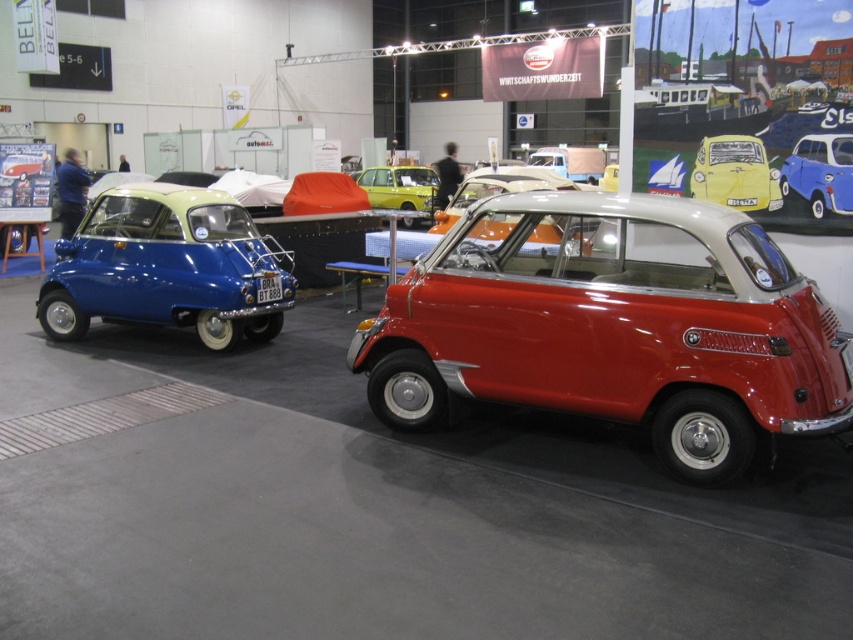
You are a photographer at the exhibition and need to capture both the yellow matte car at upper right and the blue matte car at center in a single frame. Considering their sizes, which car should be placed closer to the camera to ensure both appear balanced in the photo?

The yellow matte car at upper right is bigger than the blue matte car at center, so to balance their sizes in the photo, the blue matte car at center should be placed closer to the camera while the yellow matte car at upper right can be positioned slightly farther back.

You are a photographer planning to take a photo of both the metallic silver car at center and the metallic yellow car at center for a magazine spread. The magazine requires that the smaller car must be placed closer to the camera to appear the same size as the larger one in the photo. Which car should you position closer to the camera?

The metallic yellow car at center is smaller, so you should position it closer to the camera to make it appear the same size as the metallic silver car at center in the photo.